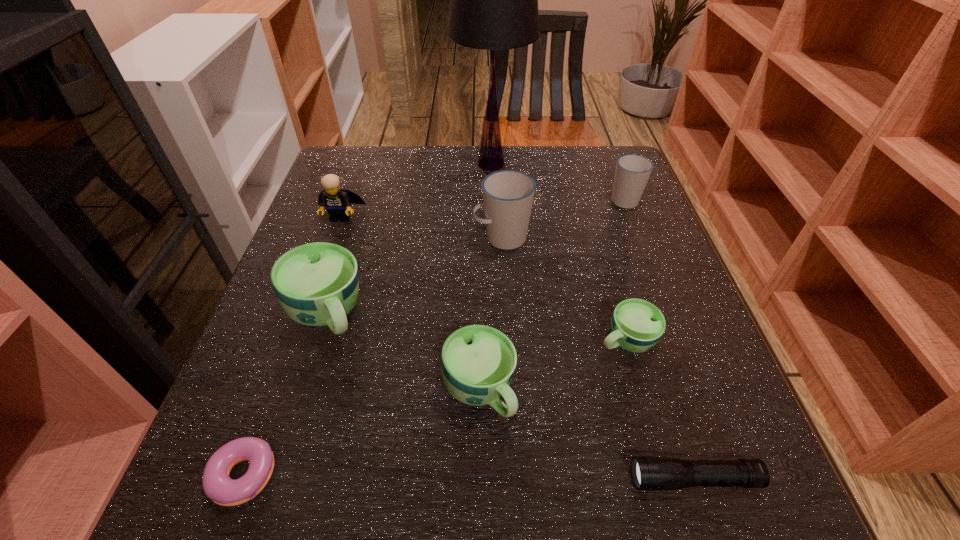
This screenshot has width=960, height=540. In order to click on the fourth shortest object in this screenshot , I will do `click(478, 362)`.

You are a GUI agent. You are given a task and a screenshot of the screen. Output one action in this format:
    pyautogui.click(x=<x>, y=<y>)
    Task: Click on the shortest cup
    The image size is (960, 540).
    Given the screenshot: What is the action you would take?
    pyautogui.click(x=636, y=325)

At what (x,y) coordinates should I click in order to perform the action: click on the smallest blue cup. Please return your answer as a coordinate pair (x, y). The height and width of the screenshot is (540, 960). Looking at the image, I should click on (636, 325).

Locate an element on the screen. the eighth tallest object is located at coordinates (649, 473).

You are a GUI agent. You are given a task and a screenshot of the screen. Output one action in this format:
    pyautogui.click(x=<x>, y=<y>)
    Task: Click on the black flashlight
    This screenshot has height=540, width=960.
    Given the screenshot: What is the action you would take?
    pyautogui.click(x=649, y=473)

The height and width of the screenshot is (540, 960). I want to click on the shortest object, so click(x=218, y=486).

The width and height of the screenshot is (960, 540). I want to click on doughnut, so click(218, 486).

Image resolution: width=960 pixels, height=540 pixels. Identify the location of free space located on the front-facing side of the lampshade. (330, 164).

Where is `vacant region located on the front-facing side of the lampshade`? vacant region located on the front-facing side of the lampshade is located at coordinates (396, 164).

Identify the location of vacant space located 0.330m on the front-facing side of the lampshade. This screenshot has height=540, width=960. (333, 164).